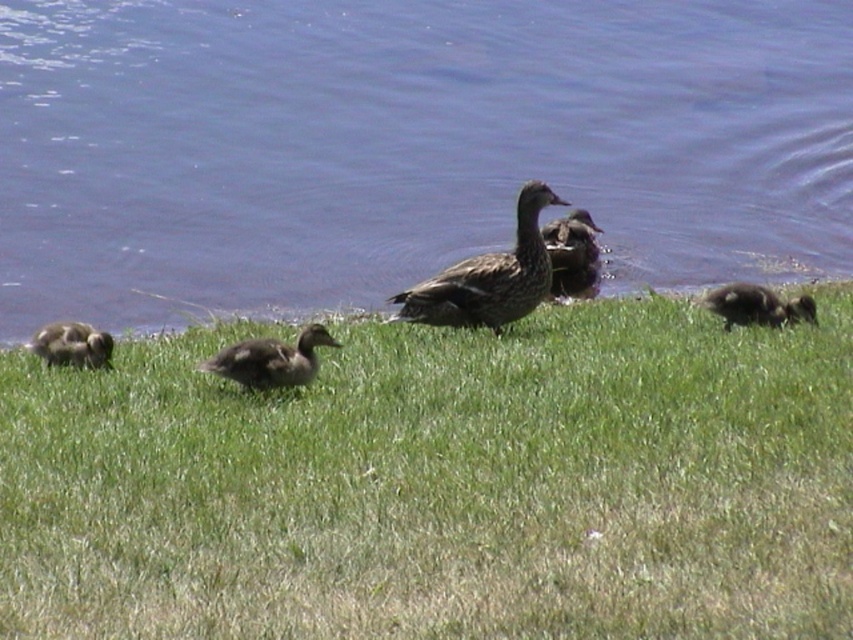
You are observing the ducks from the edge of the grassy area. There are two points marked in the scene. Which point is closer to you, point (170, 404) or point (61, 356)?

Point (170, 404) is closer to you than point (61, 356).

You are standing at the point with coordinates (x=405, y=145) in the image. What is the object located at this point?

The blue water at center is located at point (x=405, y=145).

You are a photographer trying to capture a photo of the dark brown fuzzy duckling at lower right. You are currently standing on the green grassy at center. In which direction should you move to get a better shot of the duckling?

The dark brown fuzzy duckling at lower right is to the right of the green grassy at center, so you should move to your right to get a better shot of the duckling.